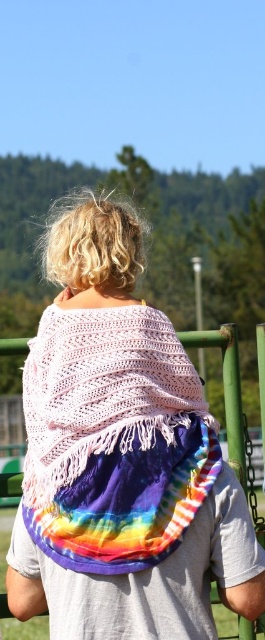
Question: Which point is farther to the camera?

Choices:
 (A) tie-dye fabric at center
 (B) crochet lace shawl at center

Answer: (A)

Question: Among these objects, which one is nearest to the camera?

Choices:
 (A) tie-dye fabric at center
 (B) crochet lace shawl at center

Answer: (B)

Question: Can you confirm if tie-dye fabric at center is positioned to the right of crochet lace shawl at center?

Choices:
 (A) yes
 (B) no

Answer: (B)

Question: Among these points, which one is farthest from the camera?

Choices:
 (A) (190, 465)
 (B) (12, 589)

Answer: (B)

Question: Does tie-dye fabric at center have a greater width compared to crochet lace shawl at center?

Choices:
 (A) no
 (B) yes

Answer: (B)

Question: Can you confirm if tie-dye fabric at center is smaller than crochet lace shawl at center?

Choices:
 (A) no
 (B) yes

Answer: (A)